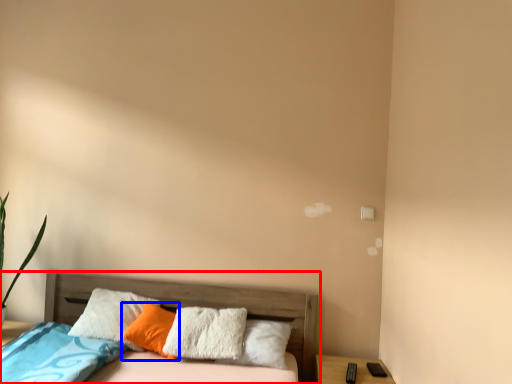
Question: Which of the following is the closest to the observer, bed (highlighted by a red box) or pillow (highlighted by a blue box)?

Choices:
 (A) bed
 (B) pillow

Answer: (A)